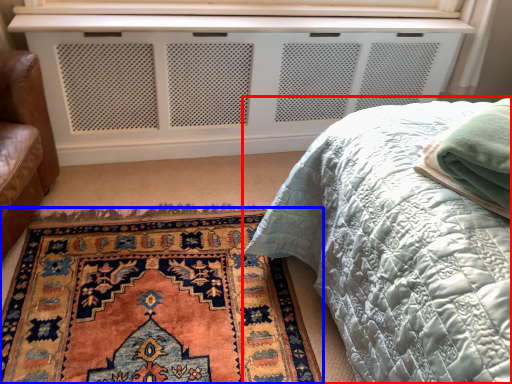
Question: Among these objects, which one is farthest to the camera, bed (highlighted by a red box) or mat (highlighted by a blue box)?

Choices:
 (A) bed
 (B) mat

Answer: (B)